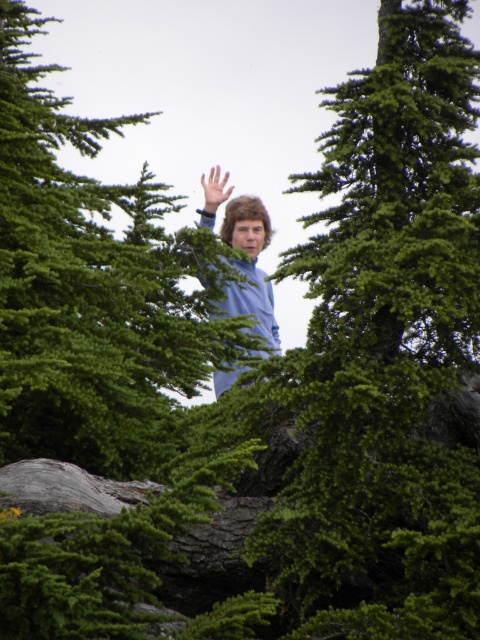
Can you confirm if green textured tree at center is bigger than smooth skin hand at center?

Correct, green textured tree at center is larger in size than smooth skin hand at center.

Is green textured tree at center behind smooth skin hand at center?

No.

Where is `green textured tree at center`? green textured tree at center is located at coordinates (91, 285).